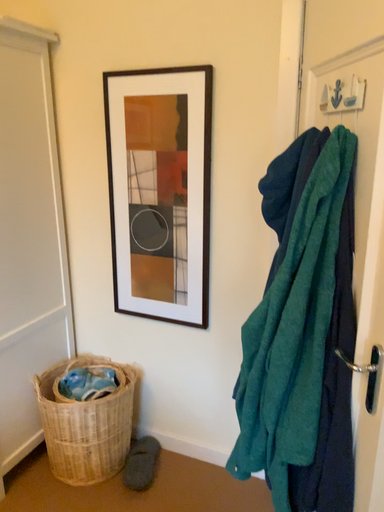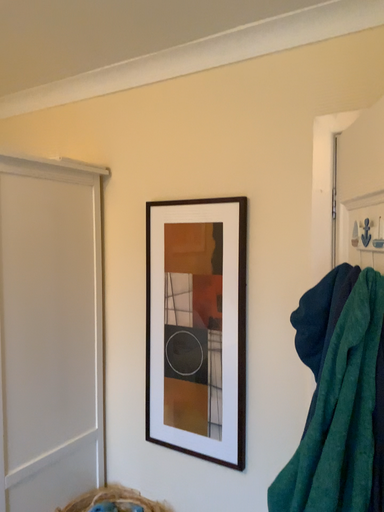
Question: Which way did the camera rotate in the video?

Choices:
 (A) rotated upward
 (B) rotated downward

Answer: (A)